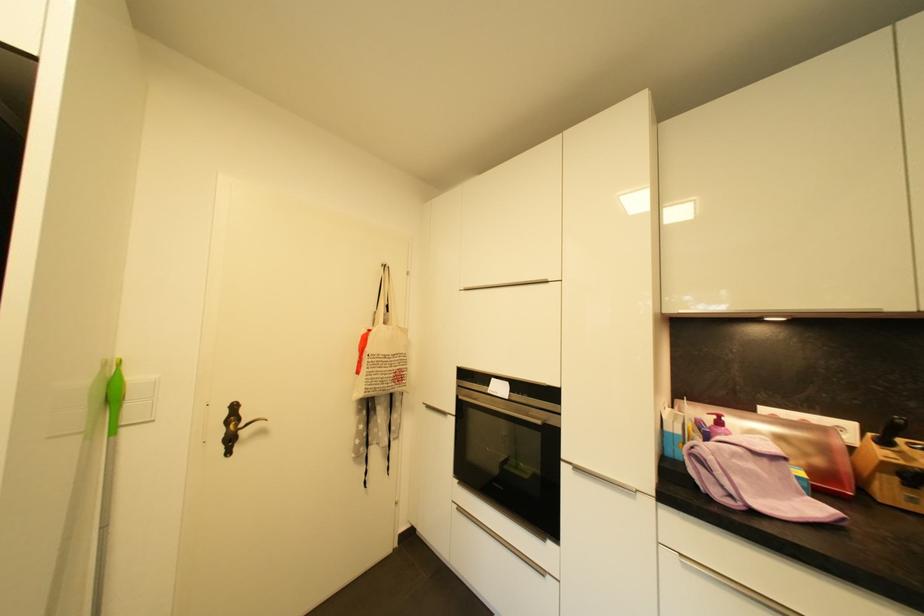
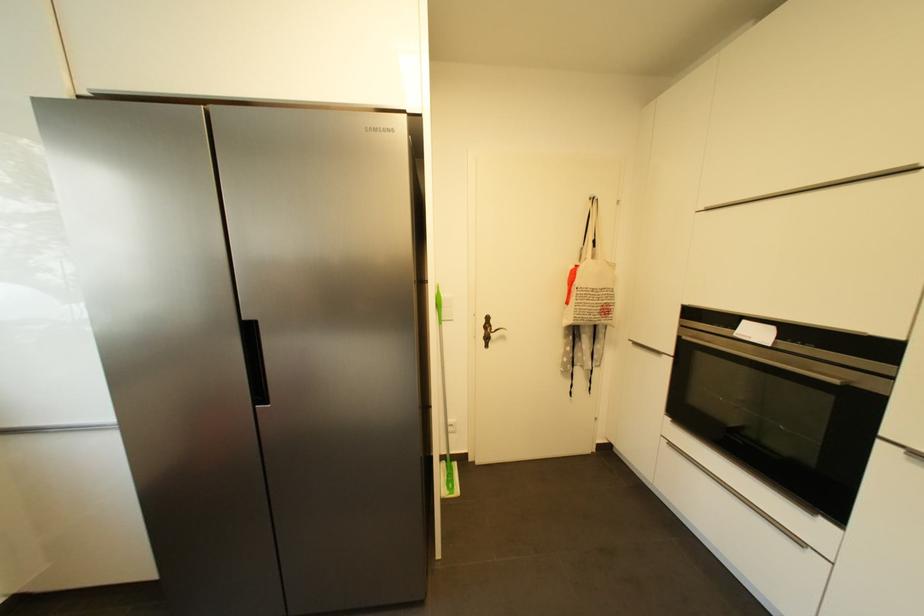
Question: How did the camera likely rotate?

Choices:
 (A) Left
 (B) Right
 (C) Up
 (D) Down

Answer: (A)